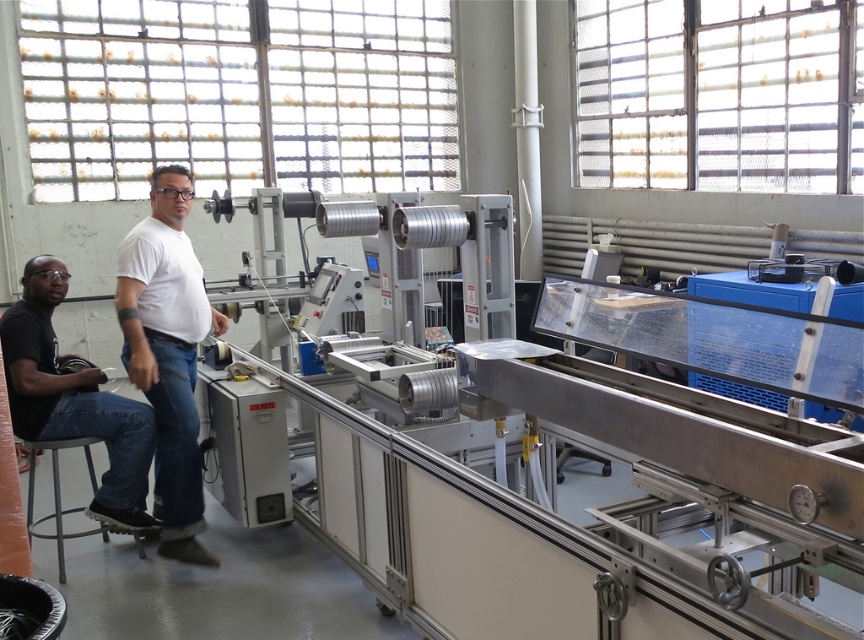
You are standing at the origin point in the image. Where is the white matte shirt at center located in terms of coordinates?

The white matte shirt at center is located at coordinates point (168, 352).

You are standing in the industrial area and see the point at coordinates (168, 352). What object is this point located on?

The point at coordinates (168, 352) is located on the white matte shirt at center.

You are an inspector in this industrial area. You need to check the machinery near the white matte shirt at center and the black matte shirt at lower left. Which shirt is closer to the machinery?

The white matte shirt at center is above the black matte shirt at lower left, so the white matte shirt at center is closer to the machinery.